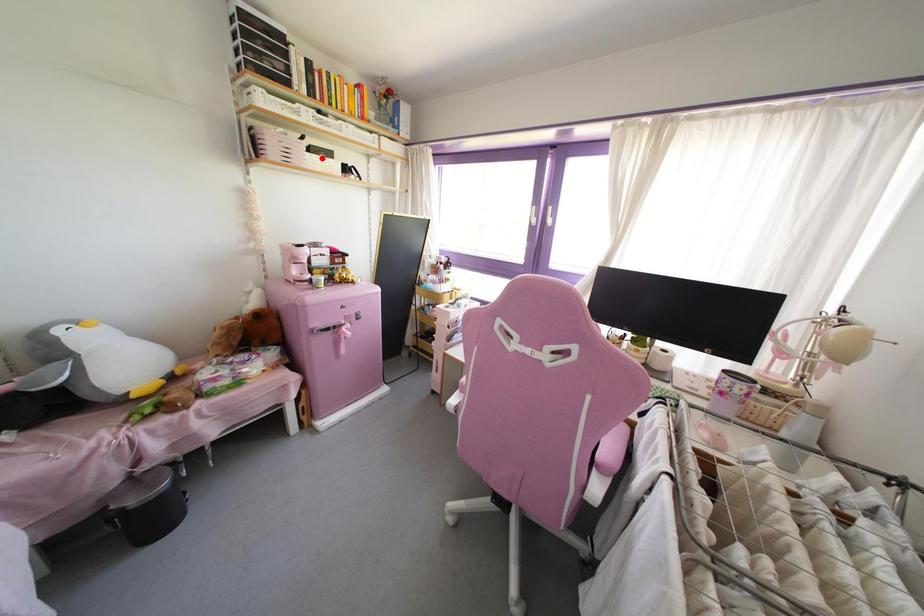
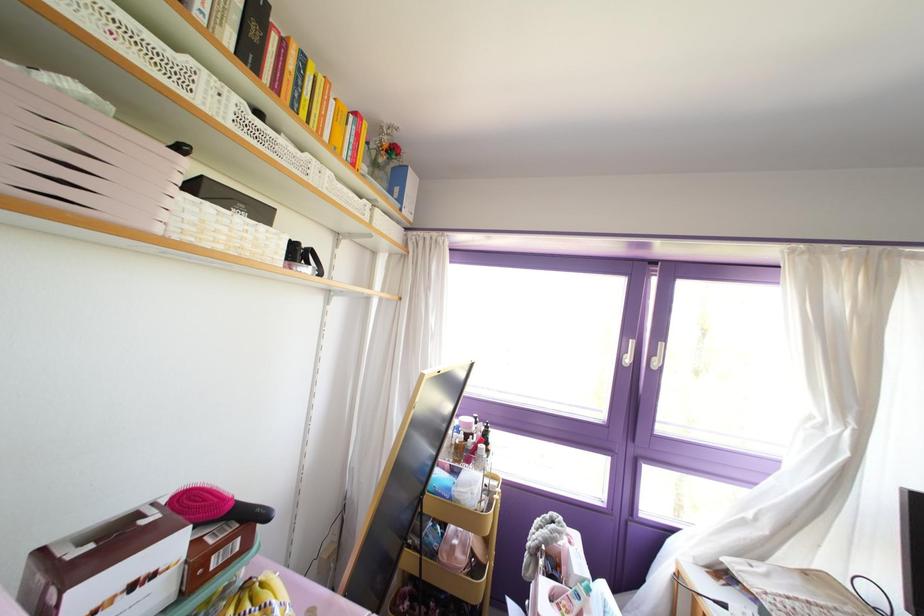
The point at the highlighted location is marked in the first image. Where is the corresponding point in the second image?

(237, 219)